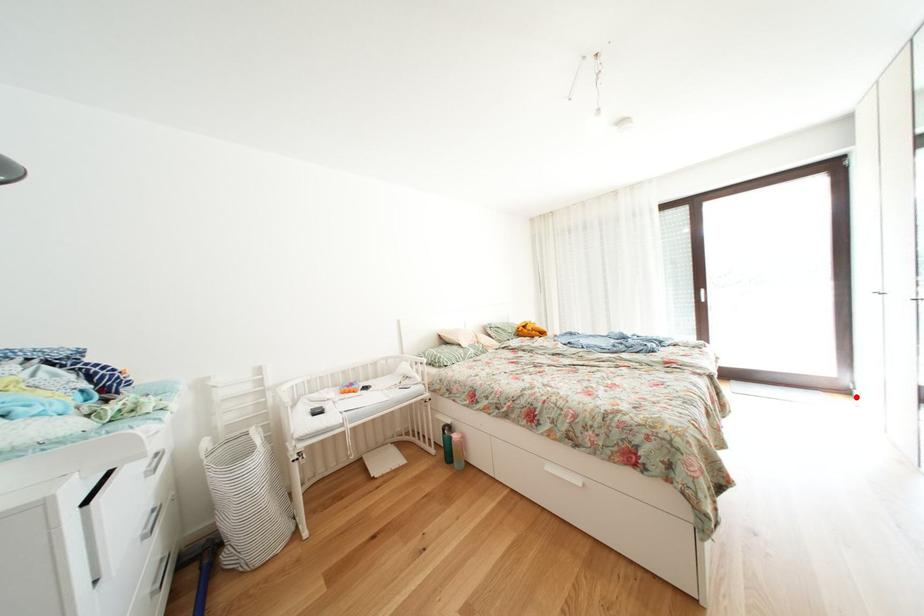
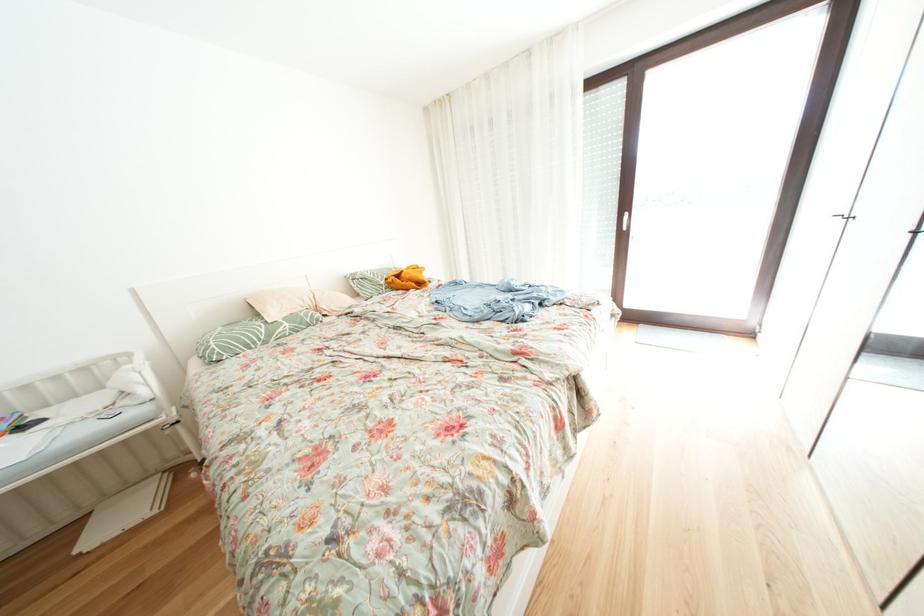
Question: A red point is marked in image1. In image2, is the corresponding 3D point closer to the camera or farther? Reply with the corresponding letter.

Choices:
 (A) The corresponding 3D point is closer.
 (B) The corresponding 3D point is farther.

Answer: (A)